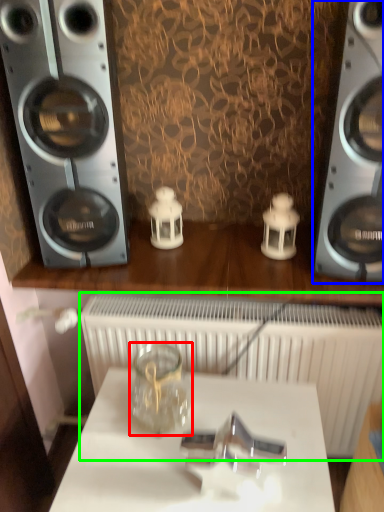
Question: Which is nearer to the glass jar (highlighted by a red box)? home appliance (highlighted by a blue box) or radiator (highlighted by a green box).

Choices:
 (A) home appliance
 (B) radiator

Answer: (B)